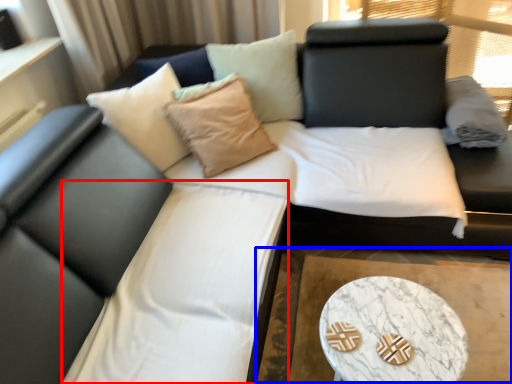
Question: Which of the following is the closest to the observer, bedding (highlighted by a red box) or cocktail table (highlighted by a blue box)?

Choices:
 (A) bedding
 (B) cocktail table

Answer: (A)